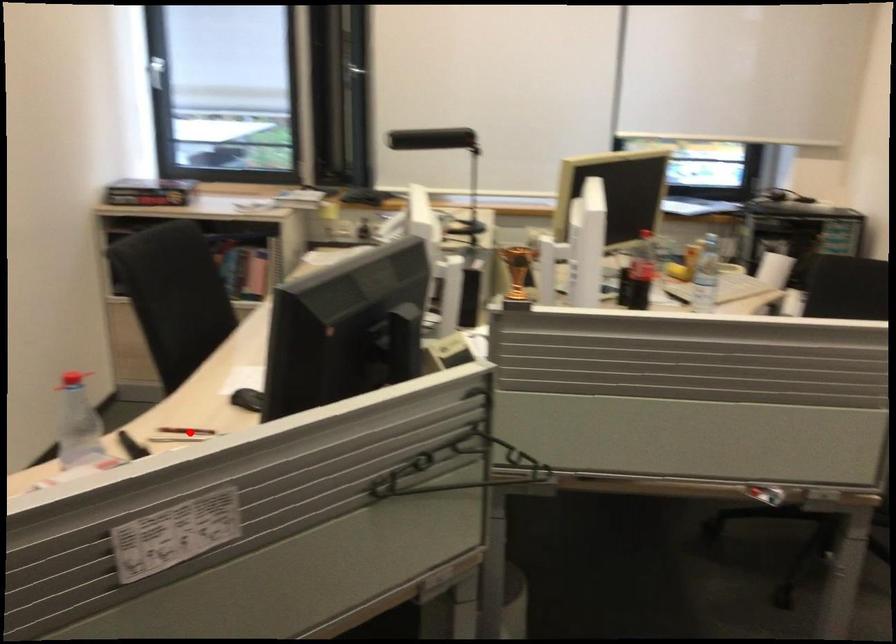
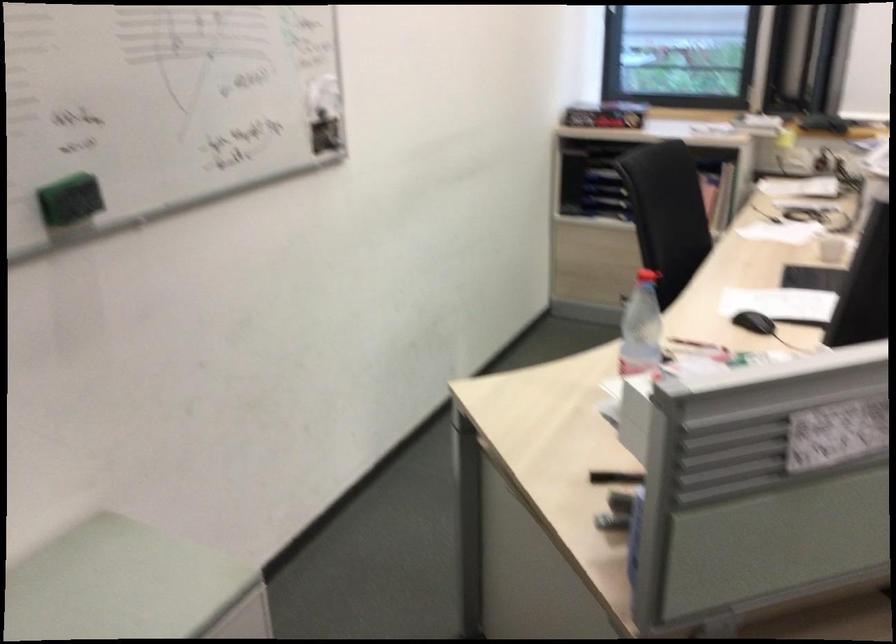
Where in the second image is the point corresponding to the highlighted location from the first image?

(695, 345)